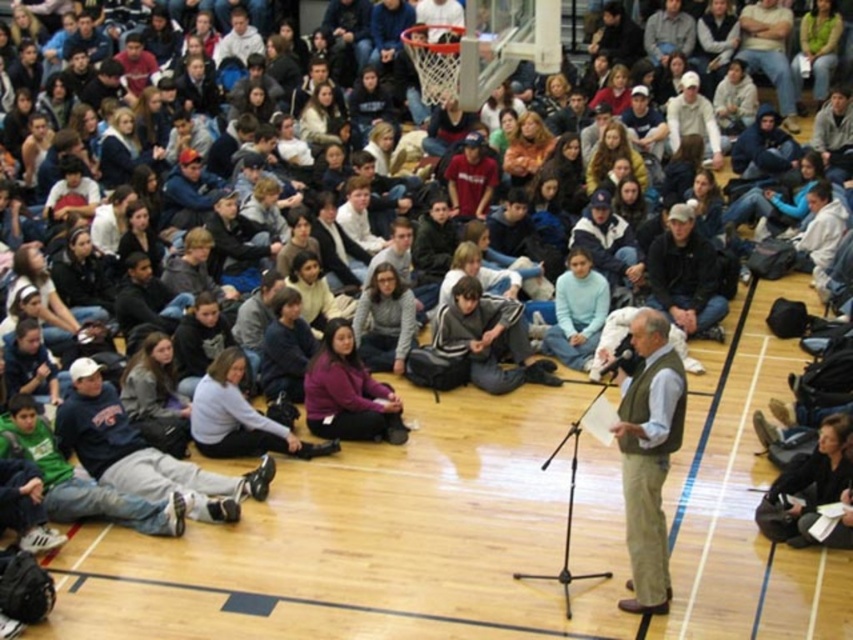
You are a photographer at the back of the gymnasium and want to take a photo of the speaker. There are two people in front of you wearing a green vest at center and a dark gray sweater at center. Which clothing item should you ask to stand up so that you can get a clear shot of the speaker?

The green vest at center is much taller than the dark gray sweater at center, so you should ask the person wearing the green vest at center to stand up to ensure a clear view of the speaker.

You are a photographer trying to capture a closeup of the speaker from the back of the gymnasium. You notice two people in the front row wearing the green vest at center and dark gray sweater at center. Which clothing item would you focus on to ensure the speaker is in focus, considering their thickness?

The green vest at center is thinner than dark gray sweater at center, so focusing on the green vest at center would allow a clearer view of the speaker since it is less obstructive.